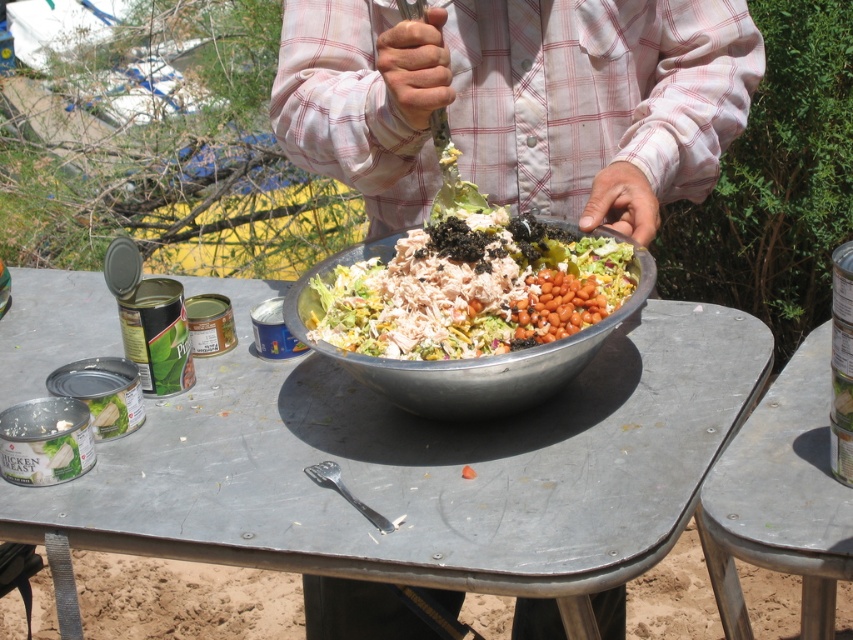
Can you confirm if plaid shirt at center is taller than metallic silver bowl at center?

Correct, plaid shirt at center is much taller as metallic silver bowl at center.

Who is shorter, plaid shirt at center or metallic silver bowl at center?

Standing shorter between the two is metallic silver bowl at center.

Does point (276, 100) come in front of point (531, 371)?

No, (276, 100) is further to viewer.

Where is `plaid shirt at center`? This screenshot has width=853, height=640. plaid shirt at center is located at coordinates (519, 100).

Is metallic gray table at center positioned before shiny metallic bowl at center?

That is True.

Does metallic gray table at center have a greater height compared to shiny metallic bowl at center?

Indeed, metallic gray table at center has a greater height compared to shiny metallic bowl at center.

Is point (225, 417) in front of point (363, 344)?

No, it is behind (363, 344).

The height and width of the screenshot is (640, 853). Find the location of `metallic gray table at center`. metallic gray table at center is located at coordinates (419, 465).

The height and width of the screenshot is (640, 853). Identify the location of shiny metallic bowl at center. (473, 289).

Is shiny metallic bowl at center above metallic gray picnic table at lower right?

Correct, shiny metallic bowl at center is located above metallic gray picnic table at lower right.

Which is in front, point (462, 246) or point (795, 486)?

Point (795, 486) is in front.

Identify the location of shiny metallic bowl at center. This screenshot has height=640, width=853. (473, 289).